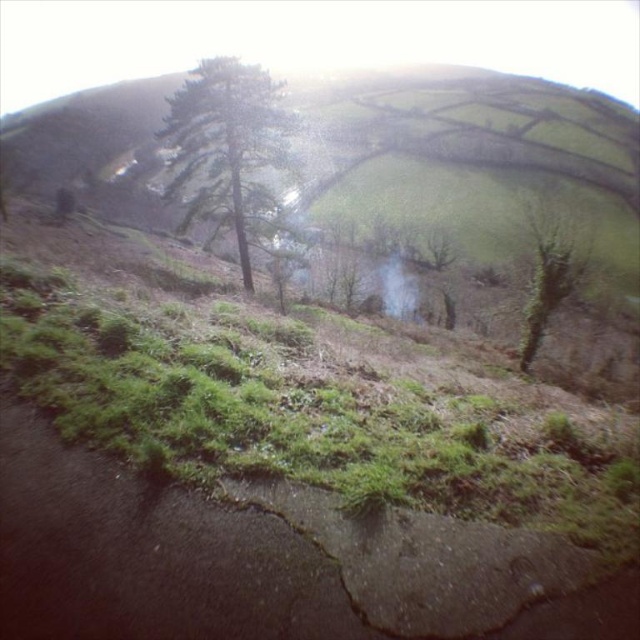
Who is shorter, green matte tree at upper center or green rough bark tree at right?

green rough bark tree at right

Describe the element at coordinates (225, 134) in the screenshot. The height and width of the screenshot is (640, 640). I see `green matte tree at upper center` at that location.

The height and width of the screenshot is (640, 640). I want to click on green matte tree at upper center, so pos(225,134).

Can you confirm if green grassy hillside at center is wider than green rough bark tree at right?

Indeed, green grassy hillside at center has a greater width compared to green rough bark tree at right.

Describe the element at coordinates (460, 157) in the screenshot. The height and width of the screenshot is (640, 640). I see `green grassy hillside at center` at that location.

The image size is (640, 640). In order to click on green grassy hillside at center in this screenshot , I will do [x=460, y=157].

Does green grassy hillside at center have a larger size compared to green matte tree at upper center?

Indeed, green grassy hillside at center has a larger size compared to green matte tree at upper center.

Who is more distant from viewer, [26,115] or [252,163]?

The point [26,115] is behind.

Consider the image. Who is more forward, (220, 216) or (243, 77)?

Point (243, 77) is more forward.

Find the location of a particular element. The width and height of the screenshot is (640, 640). green grassy hillside at center is located at coordinates (460, 157).